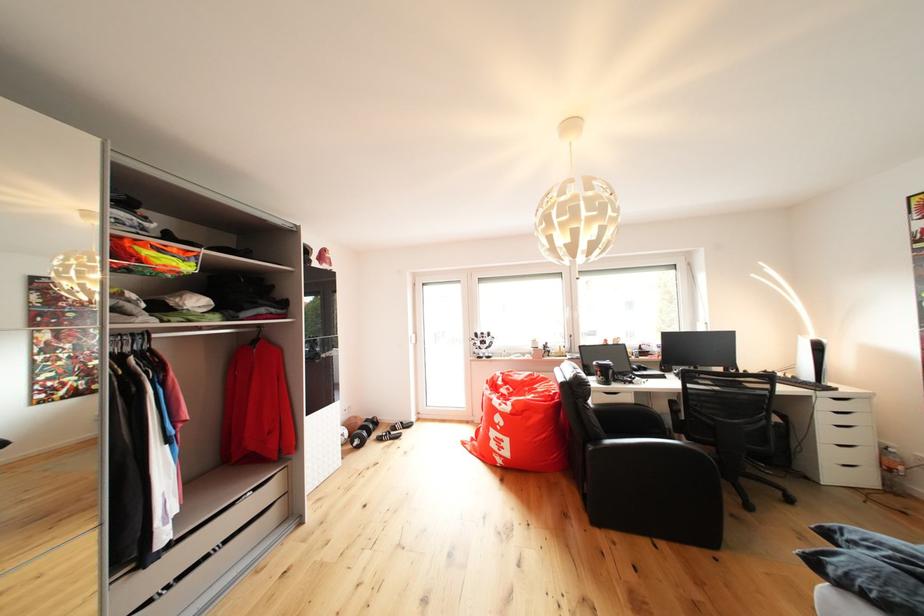
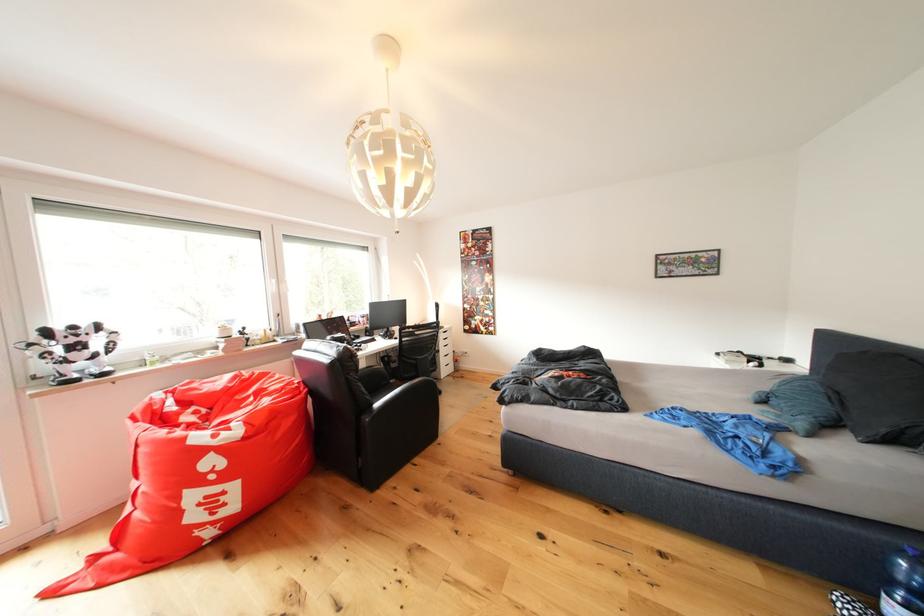
Question: The camera is either moving clockwise (left) or counter-clockwise (right) around the object. The first image is from the beginning of the video and the second image is from the end. Is the camera moving left or right when shooting the video?

Choices:
 (A) Left
 (B) Right

Answer: (A)